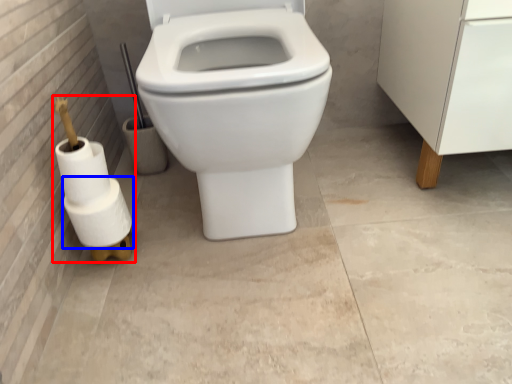
Question: Which object appears farthest to the camera in this image, toilet paper (highlighted by a red box) or toilet paper (highlighted by a blue box)?

Choices:
 (A) toilet paper
 (B) toilet paper

Answer: (B)